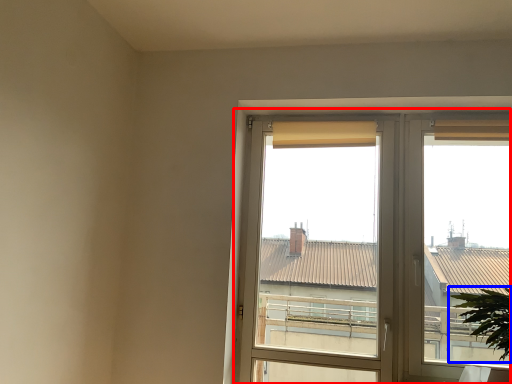
Question: Which of the following is the closest to the observer, window (highlighted by a red box) or houseplant (highlighted by a blue box)?

Choices:
 (A) window
 (B) houseplant

Answer: (B)